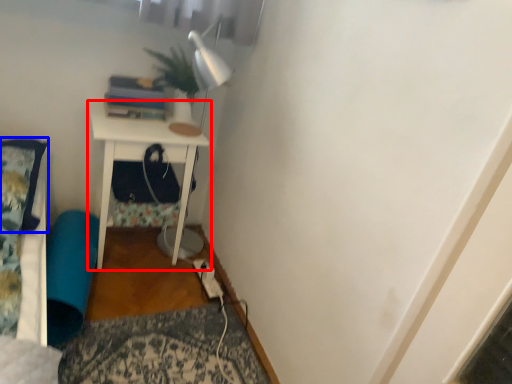
Question: Among these objects, which one is farthest to the camera, nightstand (highlighted by a red box) or pillow (highlighted by a blue box)?

Choices:
 (A) nightstand
 (B) pillow

Answer: (A)